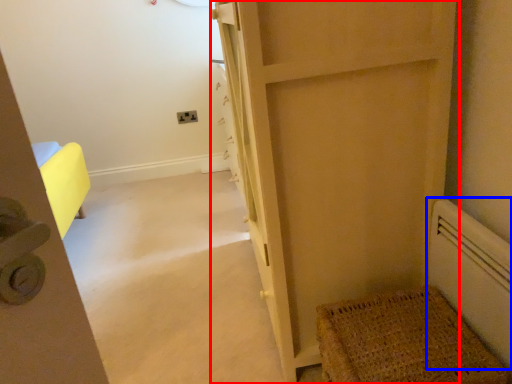
Question: Which of the following is the farthest to the observer, door (highlighted by a red box) or radiator (highlighted by a blue box)?

Choices:
 (A) door
 (B) radiator

Answer: (A)